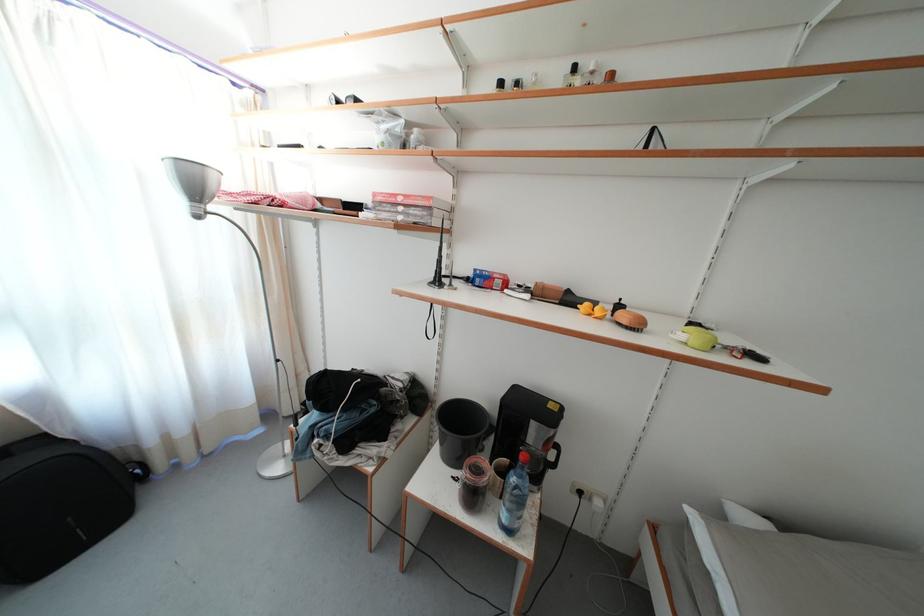
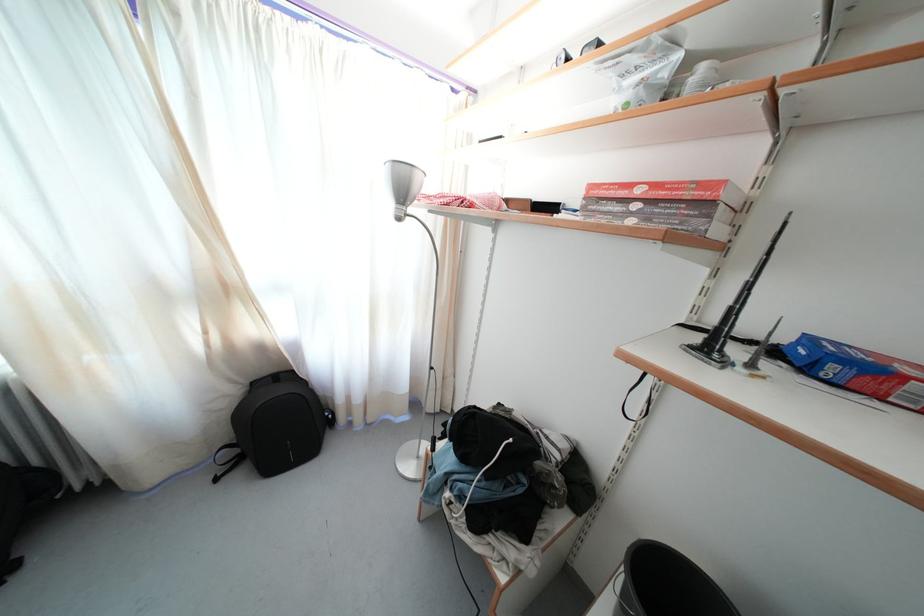
In the second image, find the point that corresponds to point 406,205 in the first image.

(645, 197)